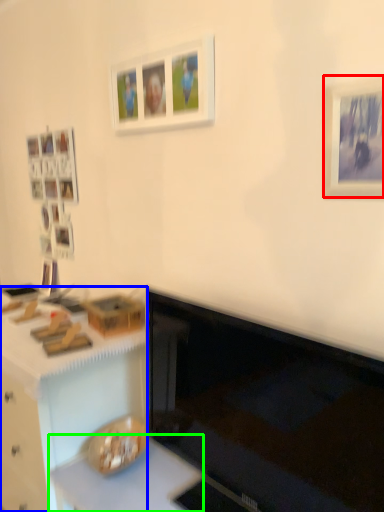
Question: Estimate the real-world distances between objects in this image. Which object is farther from picture frame (highlighted by a red box), desk (highlighted by a blue box) or counter top (highlighted by a green box)?

Choices:
 (A) desk
 (B) counter top

Answer: (A)